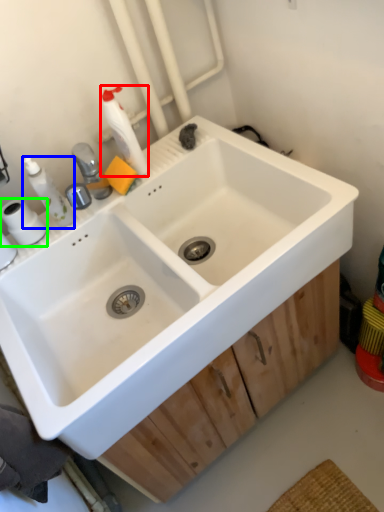
Question: Based on their relative distances, which object is nearer to cleaning product (highlighted by a red box)? Choose from toiletry (highlighted by a blue box) and toilet paper (highlighted by a green box).

Choices:
 (A) toiletry
 (B) toilet paper

Answer: (A)